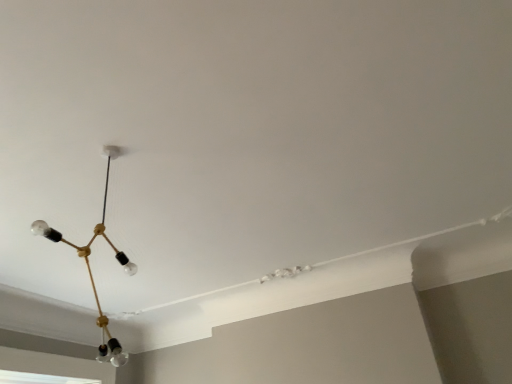
Question: From the image's perspective, is transparent glass window at lower left above or below gold metallic chandelier at upper left?

Choices:
 (A) above
 (B) below

Answer: (B)

Question: Based on their sizes in the image, would you say transparent glass window at lower left is bigger or smaller than gold metallic chandelier at upper left?

Choices:
 (A) big
 (B) small

Answer: (B)

Question: Visually, is transparent glass window at lower left positioned to the left or to the right of gold metallic chandelier at upper left?

Choices:
 (A) left
 (B) right

Answer: (A)

Question: Is gold metallic chandelier at upper left inside the boundaries of transparent glass window at lower left, or outside?

Choices:
 (A) inside
 (B) outside

Answer: (B)

Question: Based on their positions, is gold metallic chandelier at upper left located to the left or right of transparent glass window at lower left?

Choices:
 (A) left
 (B) right

Answer: (B)

Question: Looking at the image, does gold metallic chandelier at upper left seem bigger or smaller compared to transparent glass window at lower left?

Choices:
 (A) small
 (B) big

Answer: (B)

Question: Is point (x=104, y=185) positioned closer to the camera than point (x=38, y=374)?

Choices:
 (A) closer
 (B) farther

Answer: (A)